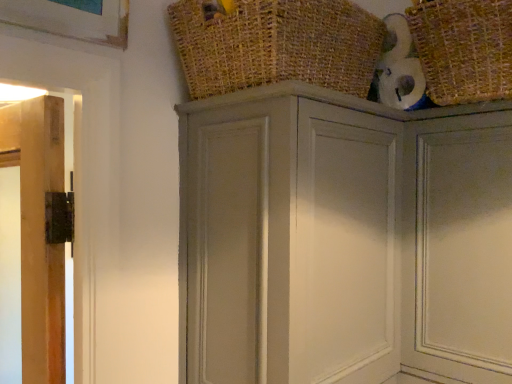
Locate an element on the screen. matte gray door at upper right is located at coordinates (458, 248).

This screenshot has height=384, width=512. I want to click on matte gray cupboard at upper center, so click(343, 240).

Find the location of a particular element. The height and width of the screenshot is (384, 512). burlap basket at upper center, the second basket viewed from the right is located at coordinates (276, 44).

The image size is (512, 384). I want to click on matte gray door at upper right, so click(x=458, y=248).

Find the location of a particular element. This screenshot has height=384, width=512. cupboard located in front of the matte gray door at upper right is located at coordinates (343, 240).

Would you say matte gray cupboard at upper center is outside matte gray door at upper right?

matte gray cupboard at upper center lies outside matte gray door at upper right's area.

Can you confirm if matte gray cupboard at upper center is positioned to the left of matte gray door at upper right?

Indeed, matte gray cupboard at upper center is positioned on the left side of matte gray door at upper right.

How far apart are matte gray cupboard at upper center and matte gray door at upper right?

matte gray cupboard at upper center is 6.21 inches from matte gray door at upper right.

Who is shorter, matte gray cupboard at upper center or woven straw basket at upper right, which is counted as the 1th basket, starting from the right?

woven straw basket at upper right, which is counted as the 1th basket, starting from the right.

Where is `cupboard that appears below the woven straw basket at upper right, which ranks as the second basket in left-to-right order (from a real-world perspective)`? The image size is (512, 384). cupboard that appears below the woven straw basket at upper right, which ranks as the second basket in left-to-right order (from a real-world perspective) is located at coordinates (343, 240).

What's the angular difference between matte gray cupboard at upper center and woven straw basket at upper right, which ranks as the second basket in left-to-right order,'s facing directions?

There is a 89.9-degree angle between the facing directions of matte gray cupboard at upper center and woven straw basket at upper right, which ranks as the second basket in left-to-right order.

Looking at this image, could you tell me if matte gray cupboard at upper center is facing woven straw basket at upper right, which ranks as the second basket in left-to-right order?

No, matte gray cupboard at upper center is not aimed at woven straw basket at upper right, which ranks as the second basket in left-to-right order.

Considering the sizes of objects matte gray door at upper right and woven straw basket at upper right, which ranks as the second basket in left-to-right order, in the image provided, who is thinner, matte gray door at upper right or woven straw basket at upper right, which ranks as the second basket in left-to-right order,?

matte gray door at upper right is thinner.

Is matte gray door at upper right looking in the opposite direction of woven straw basket at upper right, which ranks as the second basket in left-to-right order?

No, matte gray door at upper right's orientation is not away from woven straw basket at upper right, which ranks as the second basket in left-to-right order.

Which of these two, matte gray door at upper right or woven straw basket at upper right, which is counted as the 1th basket, starting from the right, stands shorter?

With less height is woven straw basket at upper right, which is counted as the 1th basket, starting from the right.

Which is in front, matte gray door at upper right or woven straw basket at upper right, which ranks as the second basket in left-to-right order?

woven straw basket at upper right, which ranks as the second basket in left-to-right order.

Between matte gray door at upper right and matte gray cupboard at upper center, which one appears on the right side from the viewer's perspective?

matte gray door at upper right is more to the right.

Looking at this image, which is closer, (474, 322) or (215, 358)?

The point (215, 358) is more forward.

From the image's perspective, is matte gray door at upper right located above or below matte gray cupboard at upper center?

Clearly, from the image's perspective, matte gray door at upper right is above matte gray cupboard at upper center.

How distant is burlap basket at upper center, placed as the first basket when sorted from left to right, from woven straw basket at upper right, which ranks as the second basket in left-to-right order?

The distance of burlap basket at upper center, placed as the first basket when sorted from left to right, from woven straw basket at upper right, which ranks as the second basket in left-to-right order, is 10.63 inches.

Which is less distant, (362,57) or (511,69)?

The point (511,69) is in front.

Considering the positions of objects burlap basket at upper center, placed as the first basket when sorted from left to right, and woven straw basket at upper right, which is counted as the 1th basket, starting from the right, in the image provided, who is behind, burlap basket at upper center, placed as the first basket when sorted from left to right, or woven straw basket at upper right, which is counted as the 1th basket, starting from the right,?

Positioned behind is woven straw basket at upper right, which is counted as the 1th basket, starting from the right.

Is burlap basket at upper center, placed as the first basket when sorted from left to right, turned away from woven straw basket at upper right, which ranks as the second basket in left-to-right order?

No, woven straw basket at upper right, which ranks as the second basket in left-to-right order, is not at the back of burlap basket at upper center, placed as the first basket when sorted from left to right.

Can you confirm if burlap basket at upper center, placed as the first basket when sorted from left to right, is positioned to the left of matte gray cupboard at upper center?

Indeed, burlap basket at upper center, placed as the first basket when sorted from left to right, is positioned on the left side of matte gray cupboard at upper center.

Are burlap basket at upper center, placed as the first basket when sorted from left to right, and matte gray cupboard at upper center making contact?

No, burlap basket at upper center, placed as the first basket when sorted from left to right, is not in contact with matte gray cupboard at upper center.

Is burlap basket at upper center, placed as the first basket when sorted from left to right, spatially inside matte gray cupboard at upper center, or outside of it?

burlap basket at upper center, placed as the first basket when sorted from left to right, cannot be found inside matte gray cupboard at upper center.

Which of these two, burlap basket at upper center, placed as the first basket when sorted from left to right, or matte gray cupboard at upper center, is bigger?

Bigger between the two is matte gray cupboard at upper center.

From the image's perspective, is woven straw basket at upper right, which is counted as the 1th basket, starting from the right, located above or below matte gray door at upper right?

woven straw basket at upper right, which is counted as the 1th basket, starting from the right, is above matte gray door at upper right.

From a real-world perspective, does woven straw basket at upper right, which is counted as the 1th basket, starting from the right, stand above matte gray door at upper right?

Correct, in the physical world, woven straw basket at upper right, which is counted as the 1th basket, starting from the right, is higher than matte gray door at upper right.

In the image, there is a woven straw basket at upper right, which is counted as the 1th basket, starting from the right. What are the coordinates of `door below it (from a real-world perspective)` in the screenshot? It's located at (458, 248).

In the scene shown: Does woven straw basket at upper right, which is counted as the 1th basket, starting from the right, have a greater height compared to matte gray door at upper right?

No.

Locate an element on the screen. This screenshot has width=512, height=384. cupboard in front of the matte gray door at upper right is located at coordinates (343, 240).

Image resolution: width=512 pixels, height=384 pixels. I want to click on basket on the right of matte gray cupboard at upper center, so click(464, 49).

Considering their positions, is woven straw basket at upper right, which ranks as the second basket in left-to-right order, positioned further to burlap basket at upper center, placed as the first basket when sorted from left to right, than matte gray cupboard at upper center?

woven straw basket at upper right, which ranks as the second basket in left-to-right order, is further to burlap basket at upper center, placed as the first basket when sorted from left to right.

When comparing their distances from matte gray cupboard at upper center, does matte gray door at upper right or burlap basket at upper center, the second basket viewed from the right, seem closer?

The object closer to matte gray cupboard at upper center is matte gray door at upper right.

Considering their positions, is burlap basket at upper center, the second basket viewed from the right, positioned closer to matte gray door at upper right than matte gray cupboard at upper center?

Based on the image, matte gray cupboard at upper center appears to be nearer to matte gray door at upper right.

Considering their positions, is burlap basket at upper center, placed as the first basket when sorted from left to right, positioned further to matte gray cupboard at upper center than woven straw basket at upper right, which ranks as the second basket in left-to-right order?

woven straw basket at upper right, which ranks as the second basket in left-to-right order, is further to matte gray cupboard at upper center.

When comparing their distances from woven straw basket at upper right, which is counted as the 1th basket, starting from the right, does burlap basket at upper center, placed as the first basket when sorted from left to right, or matte gray cupboard at upper center seem closer?

burlap basket at upper center, placed as the first basket when sorted from left to right, is closer to woven straw basket at upper right, which is counted as the 1th basket, starting from the right.

Looking at the image, which one is located closer to woven straw basket at upper right, which is counted as the 1th basket, starting from the right, burlap basket at upper center, placed as the first basket when sorted from left to right, or matte gray door at upper right?

Based on the image, matte gray door at upper right appears to be nearer to woven straw basket at upper right, which is counted as the 1th basket, starting from the right.

In the scene shown: Based on their spatial positions, is matte gray cupboard at upper center or burlap basket at upper center, placed as the first basket when sorted from left to right, closer to woven straw basket at upper right, which ranks as the second basket in left-to-right order?

burlap basket at upper center, placed as the first basket when sorted from left to right, is positioned closer to the anchor woven straw basket at upper right, which ranks as the second basket in left-to-right order.

Estimate the real-world distances between objects in this image. Which object is closer to woven straw basket at upper right, which ranks as the second basket in left-to-right order, matte gray door at upper right or matte gray cupboard at upper center?

The object closer to woven straw basket at upper right, which ranks as the second basket in left-to-right order, is matte gray door at upper right.

I want to click on basket between burlap basket at upper center, placed as the first basket when sorted from left to right, and matte gray cupboard at upper center in the up-down direction, so click(464, 49).

This screenshot has height=384, width=512. What are the coordinates of `door between burlap basket at upper center, the second basket viewed from the right, and matte gray cupboard at upper center, in the vertical direction` in the screenshot? It's located at (458, 248).

Locate an element on the screen. The width and height of the screenshot is (512, 384). basket between burlap basket at upper center, the second basket viewed from the right, and matte gray door at upper right in the up-down direction is located at coordinates (464, 49).

Where is `door that lies between woven straw basket at upper right, which is counted as the 1th basket, starting from the right, and matte gray cupboard at upper center from top to bottom`? door that lies between woven straw basket at upper right, which is counted as the 1th basket, starting from the right, and matte gray cupboard at upper center from top to bottom is located at coordinates (458, 248).